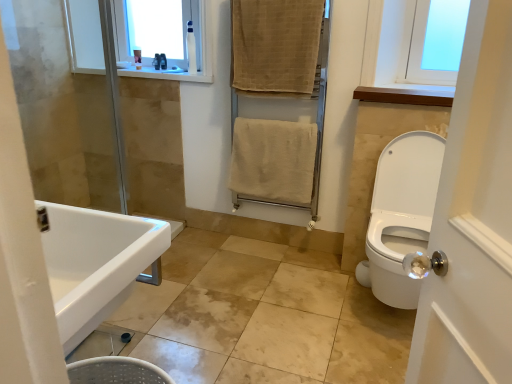
Find the location of a particular element. The width and height of the screenshot is (512, 384). beige textured towel at upper center, which appears as the first bath towel when viewed from the top is located at coordinates (276, 47).

How much space does white plastic bottle at upper center, placed as the first toiletry when sorted from right to left, occupy vertically?

white plastic bottle at upper center, placed as the first toiletry when sorted from right to left, is 12.19 inches tall.

Find the location of a particular element. This screenshot has height=384, width=512. white plastic bottle at upper center, which appears as the third toiletry when viewed from the left is located at coordinates (191, 49).

Identify the location of white glossy sink at lower left. (95, 263).

Find the location of a particular element. translucent plastic soap dispenser at upper left, arranged as the third toiletry when viewed from the front is located at coordinates (163, 61).

What do you see at coordinates (156, 27) in the screenshot? This screenshot has height=384, width=512. I see `transparent plastic bottle at upper center` at bounding box center [156, 27].

You are a GUI agent. You are given a task and a screenshot of the screen. Output one action in this format:
    pyautogui.click(x=<x>, y=<y>)
    Task: Click on the beige cotton towel at center, positioned as the first bath towel in bottom-to-top order
    
    Given the screenshot: What is the action you would take?
    pyautogui.click(x=273, y=161)

Would you consider clear plastic bottle at upper center, the 2th toiletry in the back-to-front sequence, to be distant from transparent plastic bottle at upper center?

No, clear plastic bottle at upper center, the 2th toiletry in the back-to-front sequence, is not far away from transparent plastic bottle at upper center.

How many degrees apart are the facing directions of clear plastic bottle at upper center, which is the 2th toiletry from front to back, and transparent plastic bottle at upper center?

The angle between the facing direction of clear plastic bottle at upper center, which is the 2th toiletry from front to back, and the facing direction of transparent plastic bottle at upper center is 15.9 degrees.

Is clear plastic bottle at upper center, which is the 2th toiletry from front to back, oriented away from transparent plastic bottle at upper center?

Absolutely, clear plastic bottle at upper center, which is the 2th toiletry from front to back, is directed away from transparent plastic bottle at upper center.

Image resolution: width=512 pixels, height=384 pixels. Identify the location of the 1st toiletry to the right when counting from the transparent plastic bottle at upper center. (157, 61).

In the scene shown: From a real-world perspective, which is physically above, beige textured towel rack at center or beige cotton towel at center, positioned as the first bath towel in bottom-to-top order?

beige textured towel rack at center, from a real-world perspective.

From their relative heights in the image, would you say beige textured towel rack at center is taller or shorter than beige cotton towel at center, positioned as the first bath towel in bottom-to-top order?

In the image, beige textured towel rack at center appears to be taller than beige cotton towel at center, positioned as the first bath towel in bottom-to-top order.

Relative to beige cotton towel at center, positioned as the first bath towel in bottom-to-top order, is beige textured towel rack at center in front or behind?

Visually, beige textured towel rack at center is located in front of beige cotton towel at center, positioned as the first bath towel in bottom-to-top order.

Identify the location of bath towel behind the beige textured towel rack at center. The height and width of the screenshot is (384, 512). (273, 161).

From the image's perspective, is transparent plastic bottle at upper center under translucent plastic soap dispenser at upper left, which ranks as the 2th toiletry in right-to-left order?

No.

Is transparent plastic bottle at upper center closer to camera compared to translucent plastic soap dispenser at upper left, the second toiletry when ordered from left to right?

Yes, transparent plastic bottle at upper center is closer to the camera.

Is transparent plastic bottle at upper center bigger or smaller than translucent plastic soap dispenser at upper left, arranged as the third toiletry when viewed from the front?

Clearly, transparent plastic bottle at upper center is larger in size than translucent plastic soap dispenser at upper left, arranged as the third toiletry when viewed from the front.

Considering the relative positions of transparent plastic bottle at upper center and translucent plastic soap dispenser at upper left, which ranks as the 2th toiletry in right-to-left order, in the image provided, is transparent plastic bottle at upper center to the left or to the right of translucent plastic soap dispenser at upper left, which ranks as the 2th toiletry in right-to-left order,?

From the image, it's evident that transparent plastic bottle at upper center is to the left of translucent plastic soap dispenser at upper left, which ranks as the 2th toiletry in right-to-left order.

From the picture: Can you see white glossy toilet at right touching clear plastic bottle at upper center, which is the 3th toiletry from right to left?

white glossy toilet at right is not next to clear plastic bottle at upper center, which is the 3th toiletry from right to left, and they're not touching.

Based on the photo, from a real-world perspective, is white glossy toilet at right on top of clear plastic bottle at upper center, the first toiletry in the left-to-right sequence?

No, from a real-world perspective, white glossy toilet at right is not on top of clear plastic bottle at upper center, the first toiletry in the left-to-right sequence.

Considering the points (411, 133) and (157, 53), which point is in front, point (411, 133) or point (157, 53)?

The point (411, 133) is closer to the camera.

From the image's perspective, between transparent plastic bottle at upper center and clear plastic bottle at upper center, which is the 2th toiletry from front to back, which one is located above?

transparent plastic bottle at upper center is shown above in the image.

Is transparent plastic bottle at upper center not within clear plastic bottle at upper center, the 2th toiletry in the back-to-front sequence?

Indeed, transparent plastic bottle at upper center is completely outside clear plastic bottle at upper center, the 2th toiletry in the back-to-front sequence.

Which is closer, [174,50] or [155,68]?

Point [174,50] is positioned closer to the camera compared to point [155,68].

Is transparent plastic bottle at upper center at the right side of clear plastic bottle at upper center, the 2th toiletry in the back-to-front sequence?

Incorrect, transparent plastic bottle at upper center is not on the right side of clear plastic bottle at upper center, the 2th toiletry in the back-to-front sequence.

Looking at this image, is white glossy sink at lower left smaller than translucent plastic soap dispenser at upper left, the second toiletry when ordered from left to right?

Incorrect, white glossy sink at lower left is not smaller in size than translucent plastic soap dispenser at upper left, the second toiletry when ordered from left to right.

Is point (100, 222) closer to camera compared to point (161, 67)?

Yes, point (100, 222) is in front of point (161, 67).

How distant is white glossy sink at lower left from translucent plastic soap dispenser at upper left, the second toiletry when ordered from left to right?

The distance of white glossy sink at lower left from translucent plastic soap dispenser at upper left, the second toiletry when ordered from left to right, is 2.17 meters.

Consider the image. Visually, is white glossy sink at lower left positioned to the left or to the right of translucent plastic soap dispenser at upper left, which ranks as the 2th toiletry in right-to-left order?

Based on their positions, white glossy sink at lower left is located to the right of translucent plastic soap dispenser at upper left, which ranks as the 2th toiletry in right-to-left order.

Who is bigger, beige cotton towel at center, which appears as the 2th bath towel when viewed from the top, or clear plastic bottle at upper center, the first toiletry in the left-to-right sequence?

Bigger between the two is beige cotton towel at center, which appears as the 2th bath towel when viewed from the top.

From a real-world perspective, which toiletry is the 2nd one above the beige cotton towel at center, positioned as the first bath towel in bottom-to-top order? Please provide its 2D coordinates.

[(157, 61)]

Considering the relative sizes of beige cotton towel at center, which appears as the 2th bath towel when viewed from the top, and clear plastic bottle at upper center, which is the 3th toiletry from right to left, in the image provided, is beige cotton towel at center, which appears as the 2th bath towel when viewed from the top, taller than clear plastic bottle at upper center, which is the 3th toiletry from right to left,?

Indeed, beige cotton towel at center, which appears as the 2th bath towel when viewed from the top, has a greater height compared to clear plastic bottle at upper center, which is the 3th toiletry from right to left.

Is beige cotton towel at center, which appears as the 2th bath towel when viewed from the top, not within clear plastic bottle at upper center, which is the 2th toiletry from front to back?

That's correct, beige cotton towel at center, which appears as the 2th bath towel when viewed from the top, is outside of clear plastic bottle at upper center, which is the 2th toiletry from front to back.

At what (x,y) coordinates should I click in order to perform the action: click on window located above the clear plastic bottle at upper center, which is the 3th toiletry from right to left (from the image's perspective). Please return your answer as a coordinate pair (x, y). The height and width of the screenshot is (384, 512). Looking at the image, I should click on (156, 27).

Identify the location of screen door in front of the beige cotton towel at center, positioned as the first bath towel in bottom-to-top order. Image resolution: width=512 pixels, height=384 pixels. (278, 96).

From the image, which object appears to be farther from white glossy sink at lower left, beige cotton towel at center, positioned as the first bath towel in bottom-to-top order, or clear plastic bottle at upper center, which is the 2th toiletry from front to back?

Based on the image, clear plastic bottle at upper center, which is the 2th toiletry from front to back, appears to be further to white glossy sink at lower left.

When comparing their distances from clear plastic bottle at upper center, the first toiletry in the left-to-right sequence, does white glossy toilet at right or beige textured towel at upper center, the second bath towel in the bottom-to-top sequence, seem further?

Among the two, white glossy toilet at right is located further to clear plastic bottle at upper center, the first toiletry in the left-to-right sequence.

Considering their positions, is white glossy toilet at right positioned closer to translucent plastic soap dispenser at upper left, which ranks as the 2th toiletry in right-to-left order, than transparent plastic bottle at upper center?

transparent plastic bottle at upper center lies closer to translucent plastic soap dispenser at upper left, which ranks as the 2th toiletry in right-to-left order, than the other object.

Looking at the image, which one is located further to white glossy toilet at right, translucent plastic soap dispenser at upper left, the 1th toiletry when ordered from back to front, or beige textured towel at upper center, which appears as the first bath towel when viewed from the top?

translucent plastic soap dispenser at upper left, the 1th toiletry when ordered from back to front, is further to white glossy toilet at right.

Which object lies nearer to the anchor point clear plastic bottle at upper center, which is the 3th toiletry from right to left, transparent plastic bottle at upper center or white plastic bottle at upper center, which appears as the third toiletry when viewed from the left?

Based on the image, transparent plastic bottle at upper center appears to be nearer to clear plastic bottle at upper center, which is the 3th toiletry from right to left.

Which object lies nearer to the anchor point beige textured towel at upper center, the second bath towel in the bottom-to-top sequence, white glossy sink at lower left or beige cotton towel at center, positioned as the first bath towel in bottom-to-top order?

Based on the image, beige cotton towel at center, positioned as the first bath towel in bottom-to-top order, appears to be nearer to beige textured towel at upper center, the second bath towel in the bottom-to-top sequence.

When comparing their distances from white glossy toilet at right, does white glossy sink at lower left or transparent plastic bottle at upper center seem closer?

Among the two, white glossy sink at lower left is located nearer to white glossy toilet at right.

Based on the photo, from the image, which object appears to be nearer to clear plastic bottle at upper center, the first toiletry in the left-to-right sequence, beige cotton towel at center, positioned as the first bath towel in bottom-to-top order, or white glossy toilet at right?

Based on the image, beige cotton towel at center, positioned as the first bath towel in bottom-to-top order, appears to be nearer to clear plastic bottle at upper center, the first toiletry in the left-to-right sequence.

The width and height of the screenshot is (512, 384). In order to click on screen door between beige textured towel at upper center, which appears as the first bath towel when viewed from the top, and beige cotton towel at center, positioned as the first bath towel in bottom-to-top order, from top to bottom in this screenshot , I will do `click(278, 96)`.

Find the location of `screen door situated between translucent plastic soap dispenser at upper left, the second toiletry when ordered from left to right, and white glossy toilet at right from left to right`. screen door situated between translucent plastic soap dispenser at upper left, the second toiletry when ordered from left to right, and white glossy toilet at right from left to right is located at coordinates (278, 96).

Identify the location of screen door between white glossy sink at lower left and beige cotton towel at center, which appears as the 2th bath towel when viewed from the top, in the front-back direction. (278, 96).

Where is `toiletry located between white plastic bottle at upper center, placed as the first toiletry when sorted from right to left, and translucent plastic soap dispenser at upper left, the second toiletry when ordered from left to right, in the depth direction`? Image resolution: width=512 pixels, height=384 pixels. toiletry located between white plastic bottle at upper center, placed as the first toiletry when sorted from right to left, and translucent plastic soap dispenser at upper left, the second toiletry when ordered from left to right, in the depth direction is located at coordinates (157, 61).